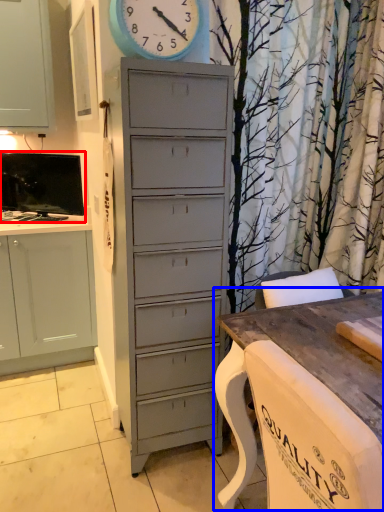
Question: Which point is further to the camera, television (highlighted by a red box) or table (highlighted by a blue box)?

Choices:
 (A) television
 (B) table

Answer: (A)